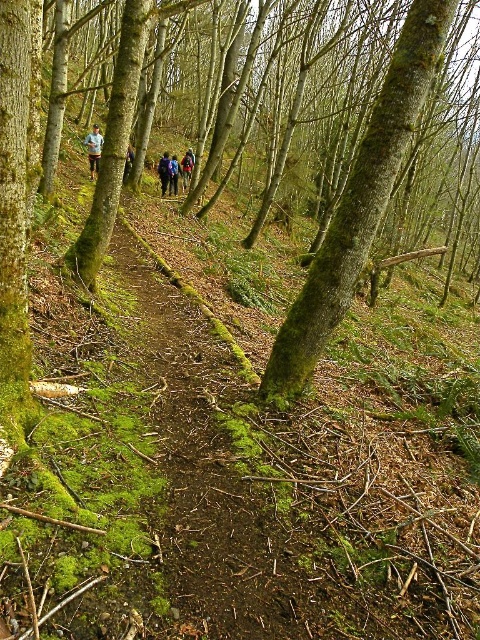
You are a hiker planning to take a photo of the green mossy tree at center and the blue fabric backpack at center. Which object should you focus on first if you want both to be in clear focus, considering their sizes?

The green mossy tree at center is bigger than the blue fabric backpack at center, so you should focus on the larger object first to ensure both are in clear focus.

Consider the image. You are a hiker walking on the narrow path in the forest. You notice a green mossy tree at center and a camouflage jacket at center. Which object is higher up from the ground?

The green mossy tree at center is located above the camouflage jacket at center, so the green mossy tree at center is higher up from the ground.

You are a hiker who wants to join the group on the path. You see the camouflage jacket at center and the blue fabric jacket at center. How far apart are these two jackets?

The camouflage jacket at center and the blue fabric jacket at center are 1.60 meters apart from each other.